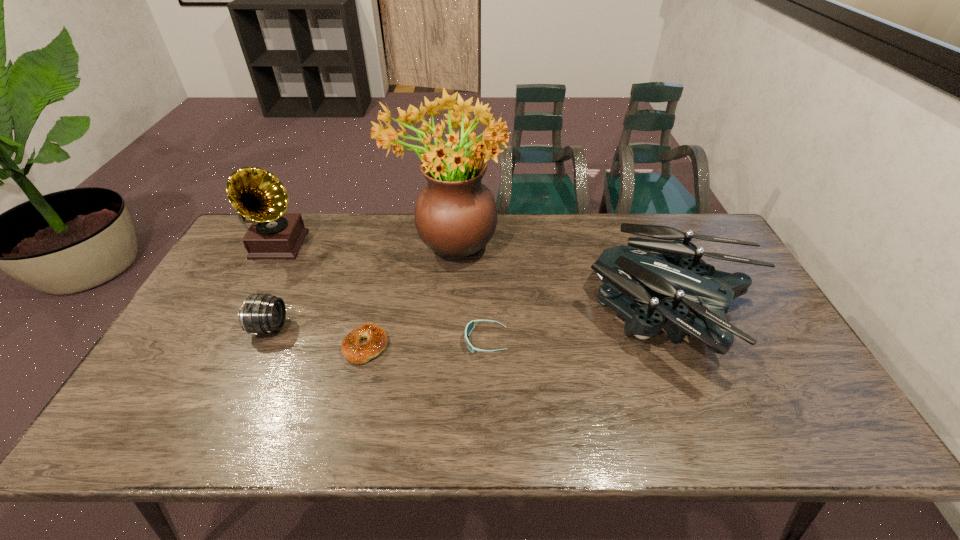
Locate an element on the screen. The image size is (960, 540). free region located 0.210m at the front element of the third shortest object is located at coordinates (361, 327).

This screenshot has height=540, width=960. What are the coordinates of `vacant space located 0.190m on the front-facing side of the goggles` in the screenshot? It's located at (394, 341).

Find the location of `vacant space located 0.360m on the front-facing side of the goggles`. vacant space located 0.360m on the front-facing side of the goggles is located at coordinates (329, 341).

Locate an element on the screen. This screenshot has width=960, height=540. vacant area situated on the front-facing side of the goggles is located at coordinates (427, 341).

Find the location of a particular element. This screenshot has width=960, height=540. vacant space located on the left of the bagel is located at coordinates (238, 346).

The image size is (960, 540). I want to click on flower arrangement that is at the far edge, so click(455, 214).

Identify the location of phonograph record that is at the far edge. (256, 194).

The height and width of the screenshot is (540, 960). Find the location of `object that is at the left edge`. object that is at the left edge is located at coordinates (256, 194).

Where is `object present at the right edge`? The image size is (960, 540). object present at the right edge is located at coordinates tap(673, 271).

At what (x,y) coordinates should I click in order to perform the action: click on object present at the far left corner. Please return your answer as a coordinate pair (x, y). Looking at the image, I should click on (256, 194).